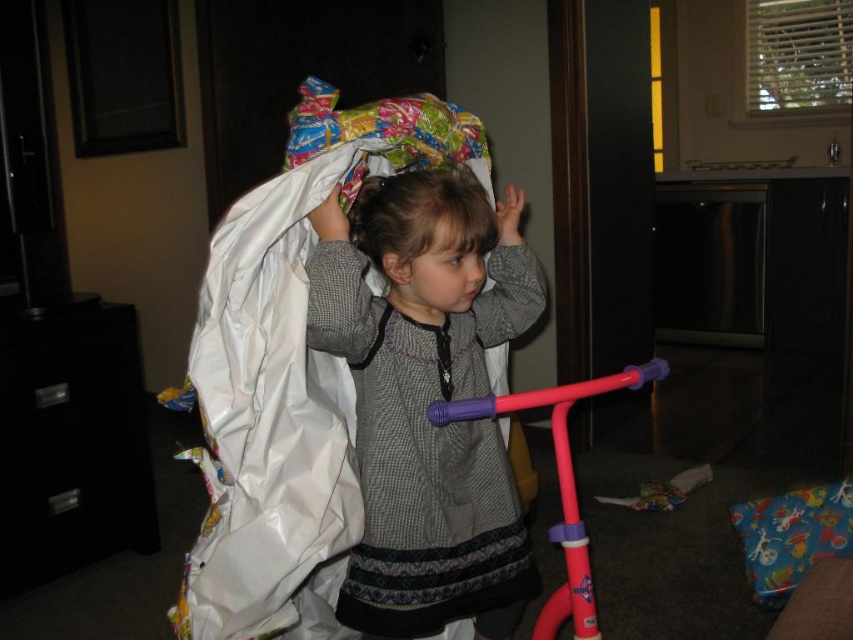
You are helping organize a closet and see the matte gray sweater at center and the smooth gray sweater at center. Which one is on top?

The smooth gray sweater at center is on top because the matte gray sweater at center is located below it.

You are a tailor trying to organize two sweaters in a display case. The case has a width of 4 inches. Can both the matte gray sweater at center and the smooth gray sweater at center fit side by side in the display case?

The matte gray sweater at center and the smooth gray sweater at center are 3.67 inches apart, so they can fit side by side in the display case since the total width required is less than 4 inches.